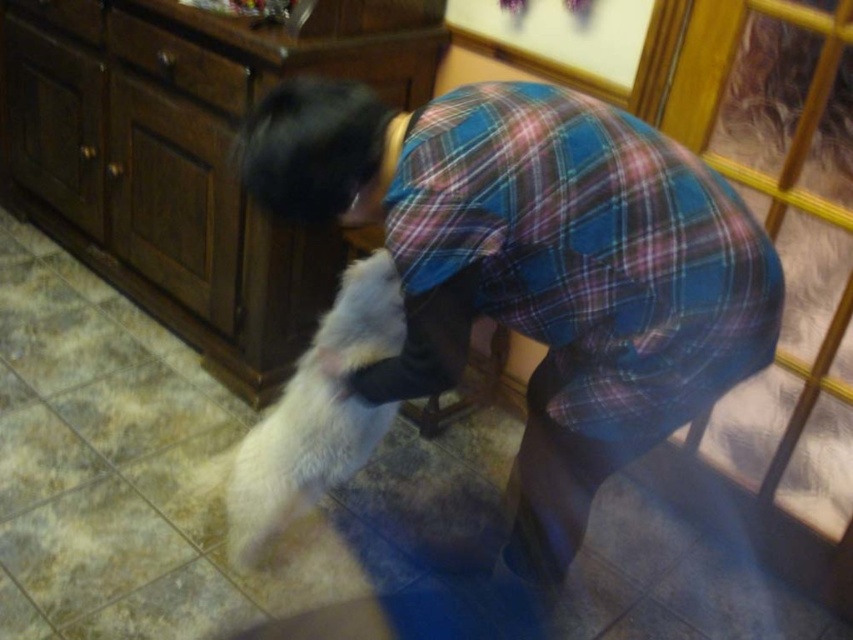
Question: Estimate the real-world distances between objects in this image. Which object is closer to the white fluffy dog at lower left?

Choices:
 (A) transparent glass door at upper right
 (B) blue plaid shirt at center

Answer: (B)

Question: Is transparent glass door at upper right below white fluffy dog at lower left?

Choices:
 (A) no
 (B) yes

Answer: (A)

Question: Which is nearer to the blue plaid shirt at center?

Choices:
 (A) white fluffy dog at lower left
 (B) transparent glass door at upper right

Answer: (A)

Question: Is blue plaid shirt at center further to camera compared to white fluffy dog at lower left?

Choices:
 (A) no
 (B) yes

Answer: (A)

Question: Can you confirm if blue plaid shirt at center is positioned to the left of white fluffy dog at lower left?

Choices:
 (A) yes
 (B) no

Answer: (B)

Question: Estimate the real-world distances between objects in this image. Which object is closer to the transparent glass door at upper right?

Choices:
 (A) white fluffy dog at lower left
 (B) blue plaid shirt at center

Answer: (B)